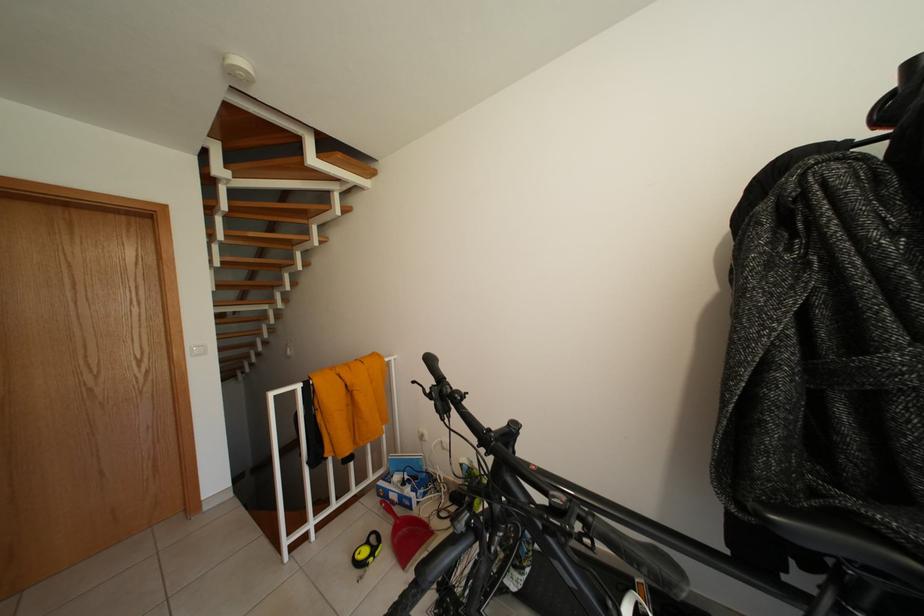
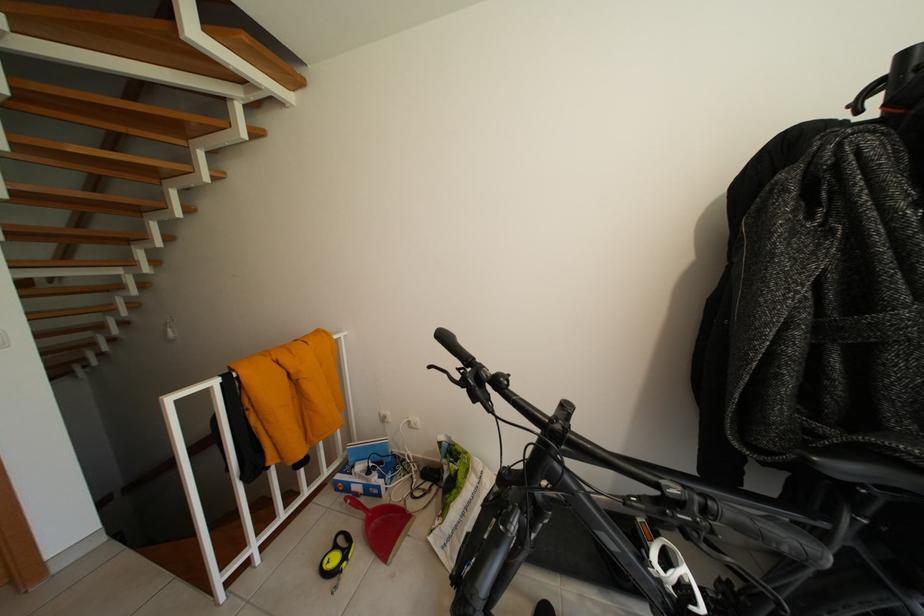
Find the pixel in the second image that matches (386,500) in the first image.

(345, 495)